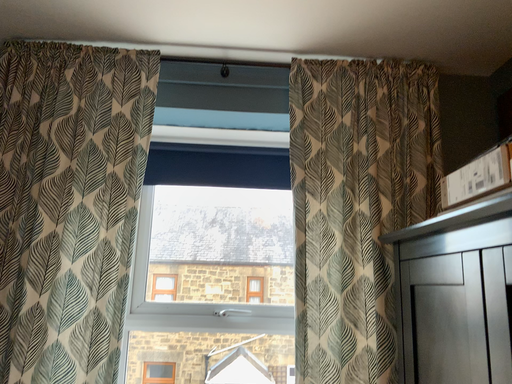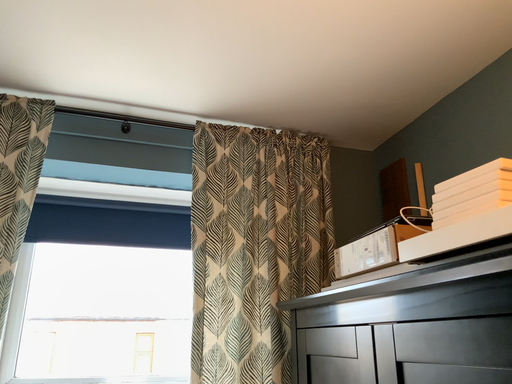
Question: How did the camera likely rotate when shooting the video?

Choices:
 (A) rotated downward
 (B) rotated upward

Answer: (B)